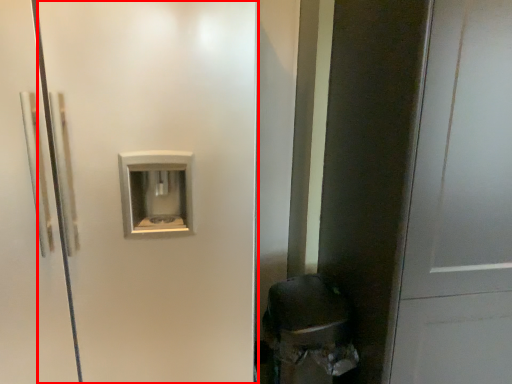
Question: In this image, where is screen door (annotated by the red box) located relative to door?

Choices:
 (A) left
 (B) right

Answer: (A)